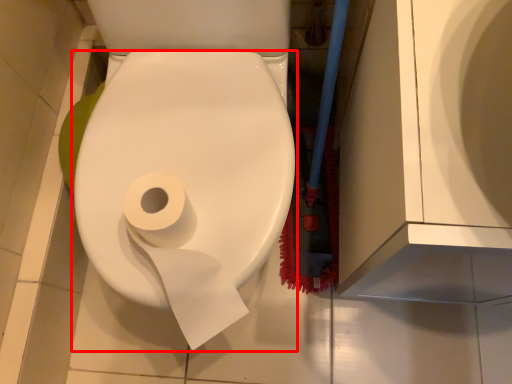
Question: From the image's perspective, where is toilet paper (annotated by the red box) located relative to toilet paper?

Choices:
 (A) above
 (B) below

Answer: (A)